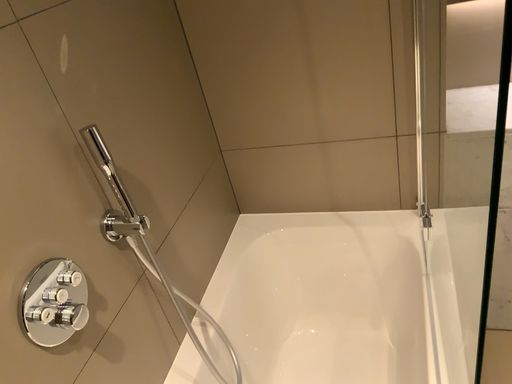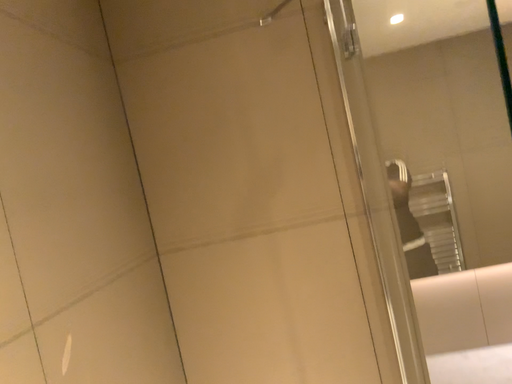
Question: Which way did the camera rotate in the video?

Choices:
 (A) rotated downward
 (B) rotated upward

Answer: (B)